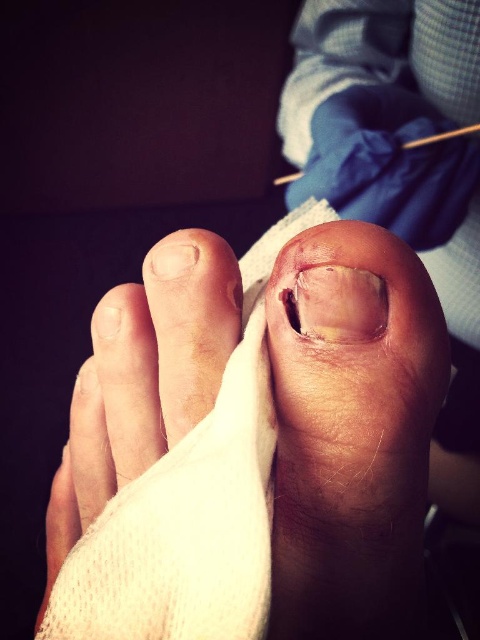
In the scene shown: Which is more to the left, dry skin toe at center or yellowish translucent nail at center?

dry skin toe at center is more to the left.

Which is behind, point (178, 298) or point (359, 323)?

Point (178, 298)

Does point (183, 268) lie behind point (336, 292)?

Yes, it is.

Find the location of a particular element. The height and width of the screenshot is (640, 480). dry skin toe at center is located at coordinates 188,326.

Is white fabric bandage at center below yellowish translucent nail at center?

Correct, white fabric bandage at center is located below yellowish translucent nail at center.

Which is behind, point (103, 586) or point (346, 269)?

The point (346, 269) is behind.

Is point (215, 476) closer to camera compared to point (290, 305)?

Yes, it is.

This screenshot has height=640, width=480. Find the location of `white fabric bandage at center`. white fabric bandage at center is located at coordinates (192, 506).

Can you confirm if yellowish skin at center is positioned to the left of dry skin toe at center?

In fact, yellowish skin at center is to the right of dry skin toe at center.

Who is taller, yellowish skin at center or dry skin toe at center?

With more height is yellowish skin at center.

The height and width of the screenshot is (640, 480). Describe the element at coordinates (350, 429) in the screenshot. I see `yellowish skin at center` at that location.

This screenshot has width=480, height=640. What are the coordinates of `yellowish skin at center` in the screenshot? It's located at (350, 429).